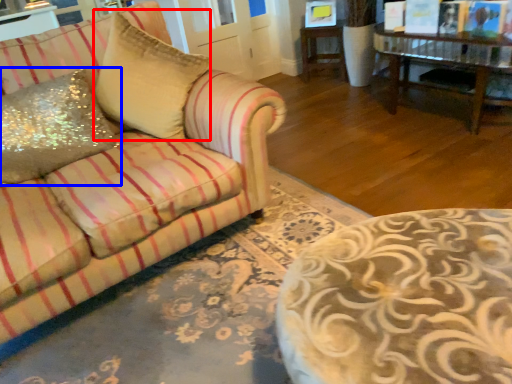
Question: Which object is closer to the camera taking this photo, throw pillow (highlighted by a red box) or throw pillow (highlighted by a blue box)?

Choices:
 (A) throw pillow
 (B) throw pillow

Answer: (B)